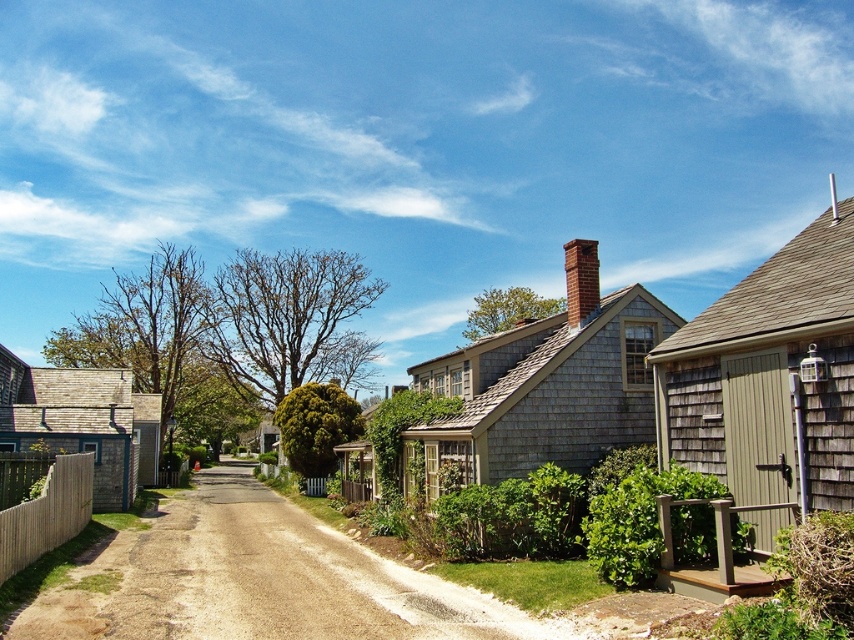
Locate an element on the screen. Image resolution: width=854 pixels, height=640 pixels. wooden picket fence at lower left is located at coordinates (47, 513).

This screenshot has width=854, height=640. Describe the element at coordinates (47, 513) in the screenshot. I see `wooden picket fence at lower left` at that location.

Where is `wooden picket fence at lower left`? wooden picket fence at lower left is located at coordinates (47, 513).